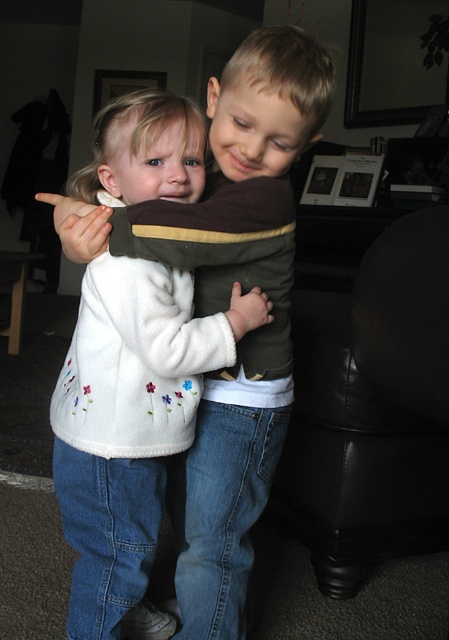
Question: Which point is closer to the camera?

Choices:
 (A) white fleece sweater at center
 (B) black leather armchair at right

Answer: (A)

Question: Does white fleece sweater at center have a greater width compared to black leather armchair at right?

Choices:
 (A) yes
 (B) no

Answer: (B)

Question: Does white fleece sweater at center appear over black leather armchair at right?

Choices:
 (A) no
 (B) yes

Answer: (B)

Question: Which point appears closest to the camera in this image?

Choices:
 (A) (194, 321)
 (B) (320, 317)

Answer: (A)

Question: Does white fleece sweater at center come behind black leather armchair at right?

Choices:
 (A) yes
 (B) no

Answer: (B)